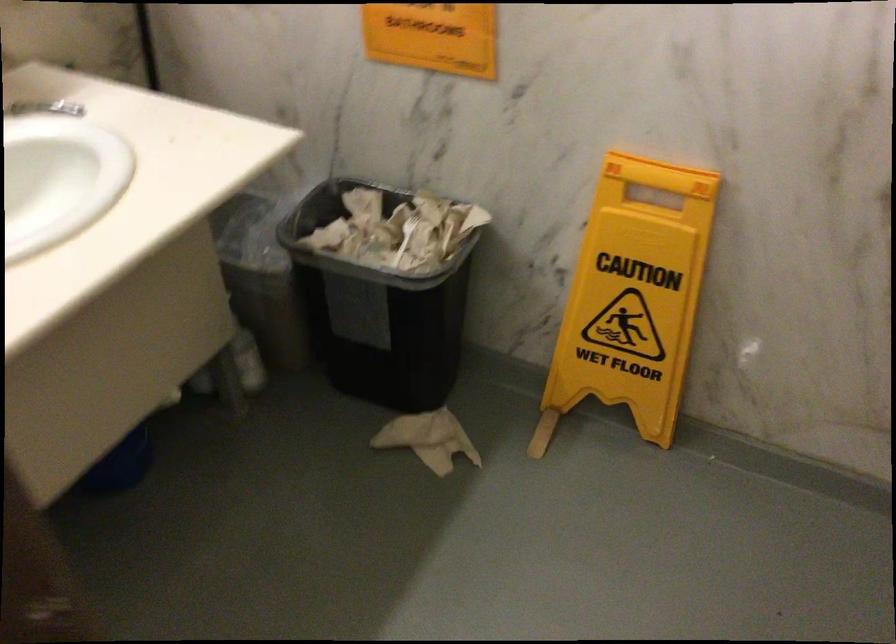
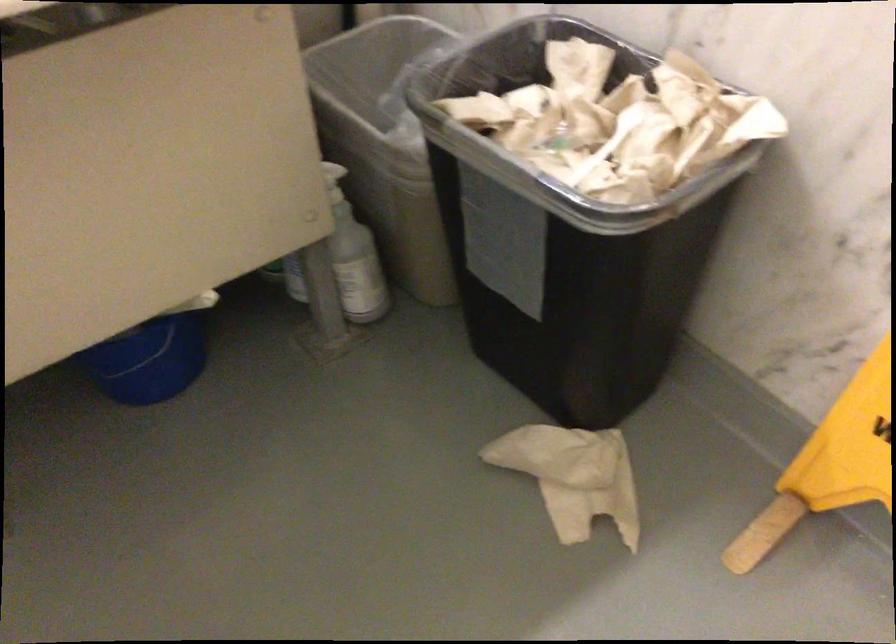
Locate, in the second image, the point that corresponds to (224,303) in the first image.

(333, 182)